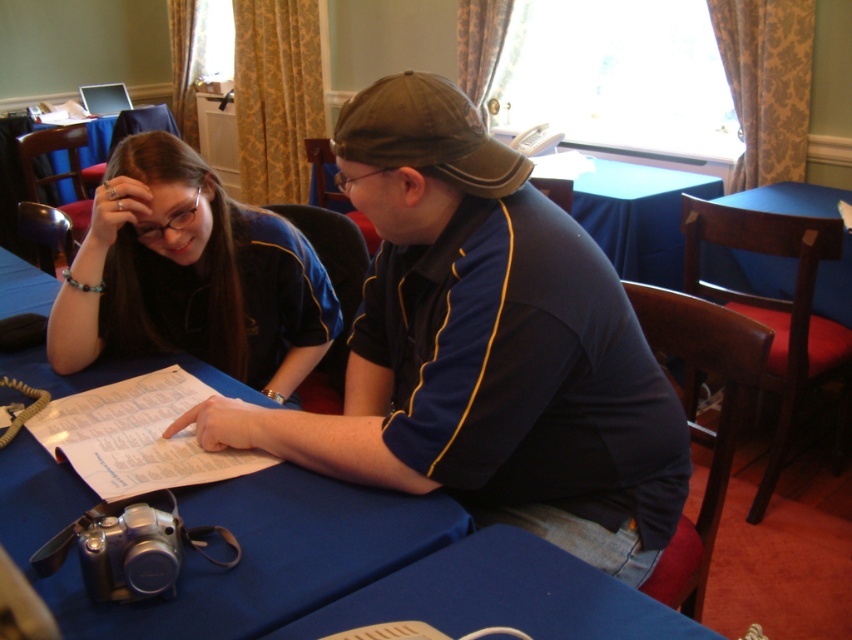
Where is `matte black shirt at center`? matte black shirt at center is located at coordinates (191, 275).

You are a GUI agent. You are given a task and a screenshot of the screen. Output one action in this format:
    pyautogui.click(x=<x>, y=<y>)
    Task: Click on the matte black shirt at center
    The image size is (852, 640).
    Given the screenshot: What is the action you would take?
    pyautogui.click(x=191, y=275)

Which is above, dark blue jersey at center or blue fabric table at lower center?

dark blue jersey at center is above.

Which is behind, point (470, 380) or point (490, 589)?

Positioned behind is point (470, 380).

Locate an element on the screen. dark blue jersey at center is located at coordinates (482, 346).

Find the location of a particular element. This screenshot has width=852, height=640. dark blue jersey at center is located at coordinates (482, 346).

Does dark blue jersey at center appear over matte black shirt at center?

No, dark blue jersey at center is not above matte black shirt at center.

Which is behind, point (534, 524) or point (102, 268)?

Positioned behind is point (102, 268).

Locate an element on the screen. This screenshot has height=640, width=852. dark blue jersey at center is located at coordinates (482, 346).